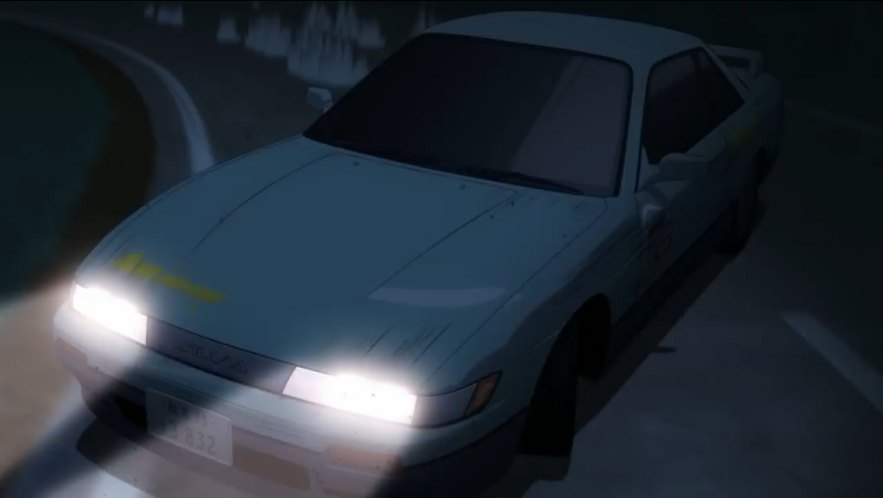
Where is `window`? This screenshot has height=498, width=883. window is located at coordinates pos(692,110).